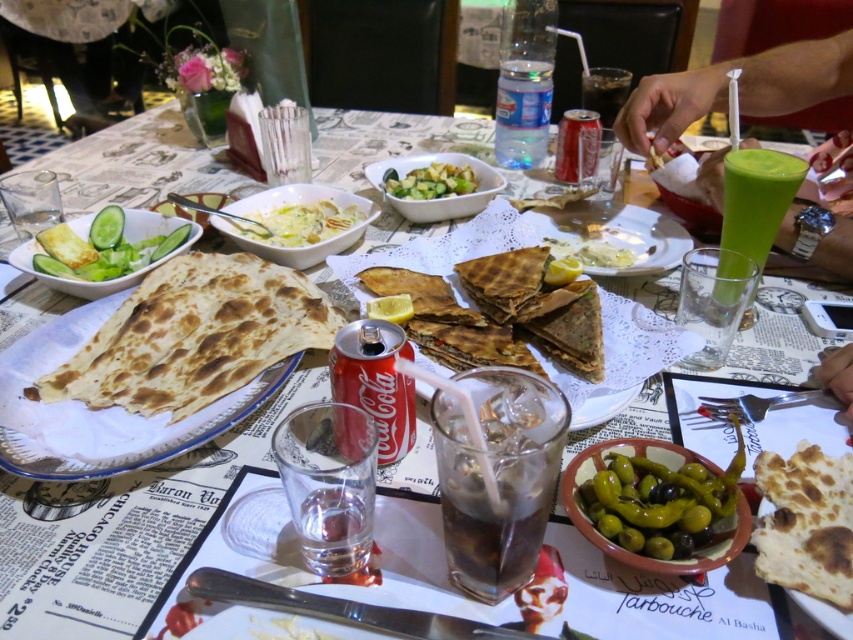
Question: Which of the following is the farthest from the observer?

Choices:
 (A) green leafy salad at left
 (B) brown matte tortilla at center

Answer: (A)

Question: Is green smoothie at right closer to camera compared to green smoothie at upper right?

Choices:
 (A) no
 (B) yes

Answer: (B)

Question: Which point is closer to the camera?

Choices:
 (A) transparent plastic bottle at center
 (B) white ceramic plate at center
 (C) green leafy salad at left
 (D) green smoothie at upper right

Answer: (D)

Question: Among these points, which one is nearest to the camera?

Choices:
 (A) (772, 196)
 (B) (593, 262)

Answer: (A)

Question: Does brown/crumbly tortilla at lower right have a smaller size compared to green smoothie at upper right?

Choices:
 (A) yes
 (B) no

Answer: (A)

Question: Does brown/crumbly tortilla at lower right have a lesser width compared to white creamy soup at center?

Choices:
 (A) yes
 (B) no

Answer: (A)